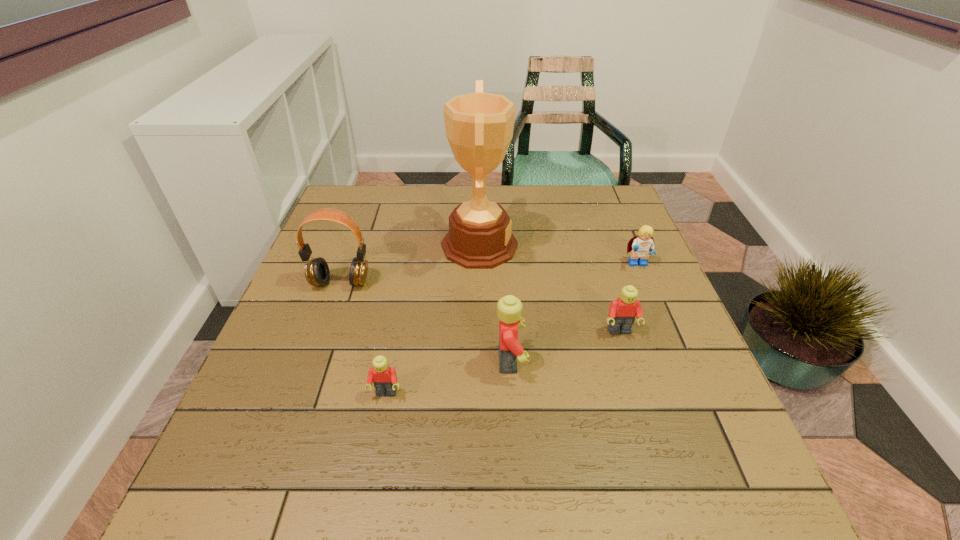
Please point a vacant point for placing a Lego on the left. Please provide its 2D coordinates. Your answer should be formatted as a tuple, i.e. [(x, y)], where the tuple contains the x and y coordinates of a point satisfying the conditions above.

[(243, 431)]